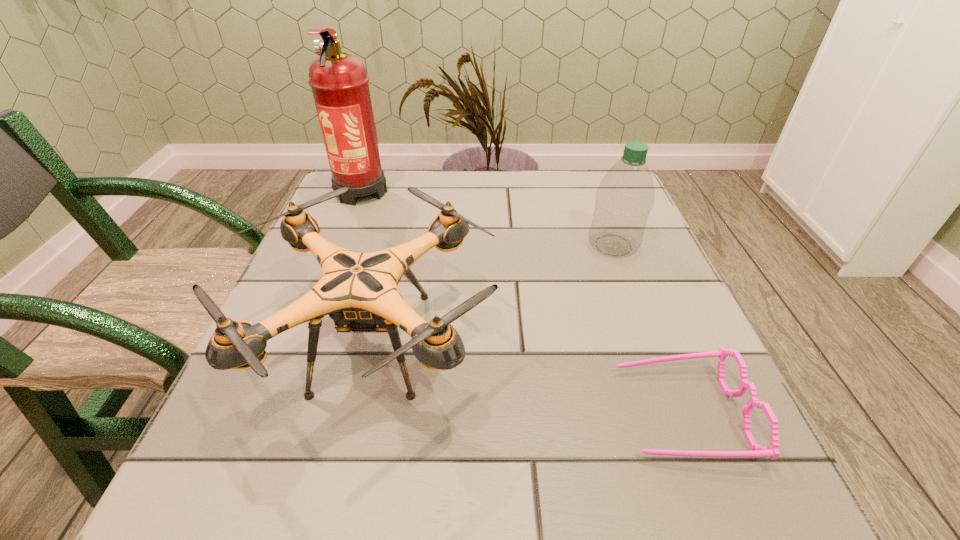
This screenshot has height=540, width=960. In order to click on object that is at the near right corner in this screenshot , I will do `click(771, 451)`.

Find the location of `vacant space at the far edge of the desktop`. vacant space at the far edge of the desktop is located at coordinates (468, 206).

In the image, there is a desktop. Identify the location of vacant space at the near edge. (396, 461).

Where is `vacant space at the right edge of the desktop`? This screenshot has height=540, width=960. vacant space at the right edge of the desktop is located at coordinates (643, 245).

This screenshot has width=960, height=540. I want to click on free space at the far left corner of the desktop, so click(329, 219).

You are a GUI agent. You are given a task and a screenshot of the screen. Output one action in this format:
    pyautogui.click(x=<x>, y=<y>)
    Task: Click on the vacant space at the far right corner of the desktop
    Image resolution: width=960 pixels, height=540 pixels.
    Given the screenshot: What is the action you would take?
    pyautogui.click(x=590, y=194)

The width and height of the screenshot is (960, 540). I want to click on vacant space at the near right corner of the desktop, so pyautogui.click(x=662, y=513).

What are the coordinates of `free space between the fire extinguisher and the water bottle` in the screenshot? It's located at (488, 218).

Find the location of `vacant space in between the fire extinguisher and the shortest object`. vacant space in between the fire extinguisher and the shortest object is located at coordinates (521, 301).

I want to click on vacant point located between the tallest object and the water bottle, so click(x=488, y=218).